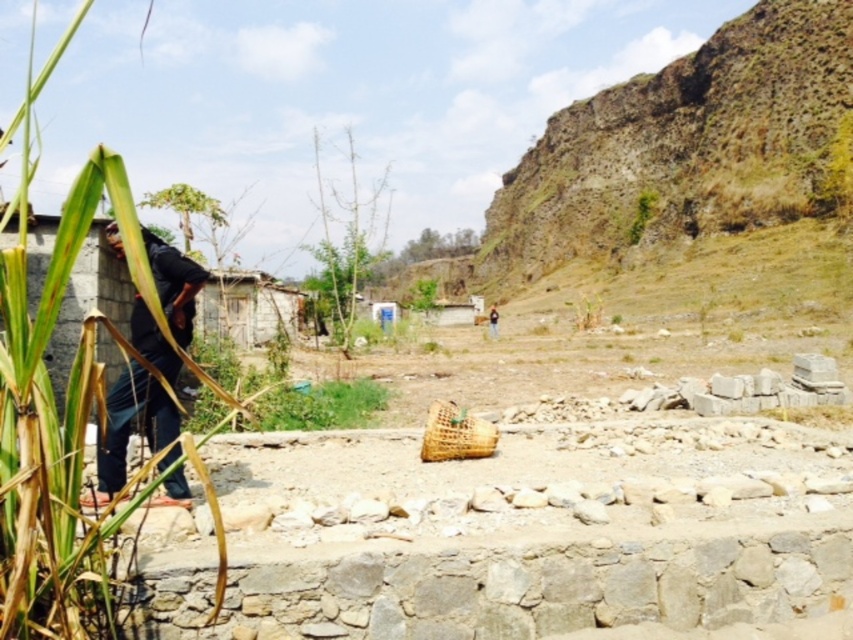
Does green leafy reed at left appear on the left side of woven bamboo basket at center?

Indeed, green leafy reed at left is positioned on the left side of woven bamboo basket at center.

Does point (154, 376) come closer to viewer compared to point (456, 426)?

Yes, it is in front of point (456, 426).

Image resolution: width=853 pixels, height=640 pixels. I want to click on green leafy reed at left, so click(64, 404).

Is dark blue jeans at left below green grass at center?

Incorrect, dark blue jeans at left is not positioned below green grass at center.

Based on the photo, is dark blue jeans at left bigger than green grass at center?

Yes, dark blue jeans at left is bigger than green grass at center.

The height and width of the screenshot is (640, 853). What are the coordinates of `dark blue jeans at left` in the screenshot? It's located at (131, 428).

I want to click on dark blue jeans at left, so click(131, 428).

Which of these two, green leafy reed at left or dark blue jeans at left, stands shorter?

dark blue jeans at left is shorter.

Is point (30, 465) farther from viewer compared to point (149, 236)?

No, (30, 465) is closer to viewer.

Who is more forward, (x=137, y=502) or (x=169, y=298)?

Positioned in front is point (x=137, y=502).

The image size is (853, 640). I want to click on green leafy reed at left, so click(64, 404).